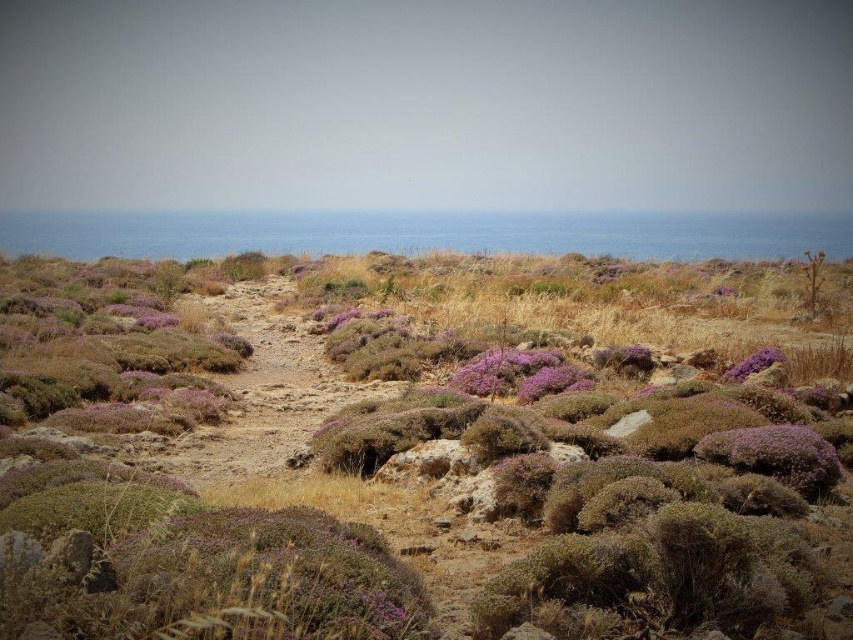
Does purple shrubbery at center come in front of purple fuzzy bush at center?

Yes, it is in front of purple fuzzy bush at center.

Does point (317, 413) lie behind point (550, 378)?

No, it is in front of (550, 378).

Who is more forward, (157, 413) or (524, 387)?

Point (157, 413) is more forward.

At what (x,y) coordinates should I click in order to perform the action: click on purple shrubbery at center. Please return your answer as a coordinate pair (x, y). This screenshot has width=853, height=640. Looking at the image, I should click on (405, 483).

Is point (467, 365) farther from camera compared to point (730, 369)?

Yes, point (467, 365) is farther from viewer.

The image size is (853, 640). Find the location of `purple shrubbery at center`. purple shrubbery at center is located at coordinates (405, 483).

Which is behind, point (259, 451) or point (770, 356)?

Point (770, 356)

You are a GUI agent. You are given a task and a screenshot of the screen. Output one action in this format:
    pyautogui.click(x=<x>, y=<y>)
    Task: Click on the purple shrubbery at center
    Image resolution: width=853 pixels, height=640 pixels.
    Given the screenshot: What is the action you would take?
    pyautogui.click(x=405, y=483)

Is purple fuzzy bush at center in front of purple fuzzy bush at center-right?

Yes, purple fuzzy bush at center is closer to the viewer.

Does purple fuzzy bush at center appear on the right side of purple fuzzy bush at center-right?

Incorrect, purple fuzzy bush at center is not on the right side of purple fuzzy bush at center-right.

This screenshot has width=853, height=640. Describe the element at coordinates (553, 381) in the screenshot. I see `purple fuzzy bush at center` at that location.

Where is `purple fuzzy bush at center`? The image size is (853, 640). purple fuzzy bush at center is located at coordinates (553, 381).